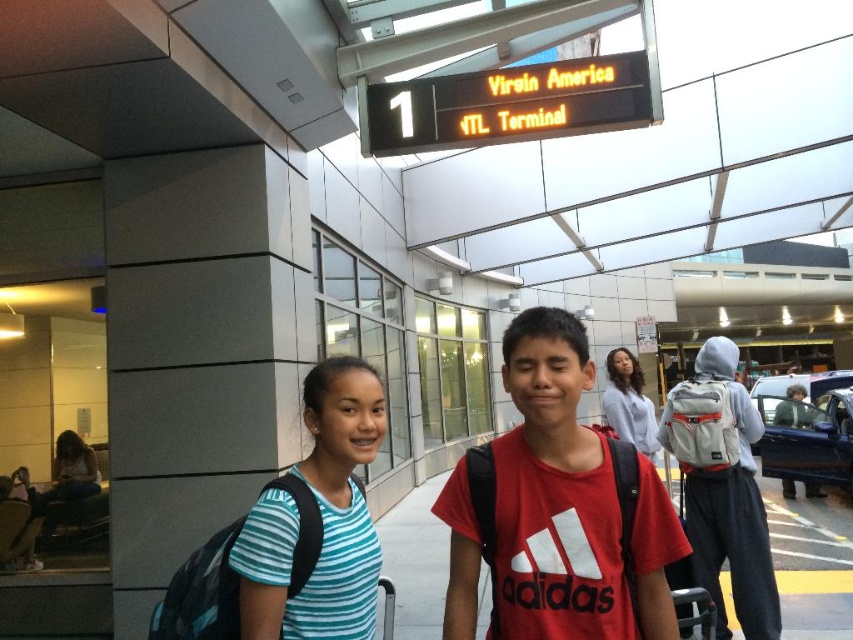
You are an airport security agent checking the size of the shirts for a uniform policy. The policy requires that all shirts must be of the same size. Which shirt, the striped fabric shirt at center or the red matte adidas shirt at center, violates the size requirement?

The striped fabric shirt at center is smaller than the red matte adidas shirt at center, so the striped fabric shirt at center violates the size requirement since it is not the same size as the red matte adidas shirt at center.

You are a photographer positioned in the airport terminal. You need to capture a photo where the red matte adidas shirt at center and the teal striped shirt at center are both visible. Based on their positions, which shirt appears higher in the photo?

The red matte adidas shirt at center appears higher in the photo because it is positioned above the teal striped shirt at center.